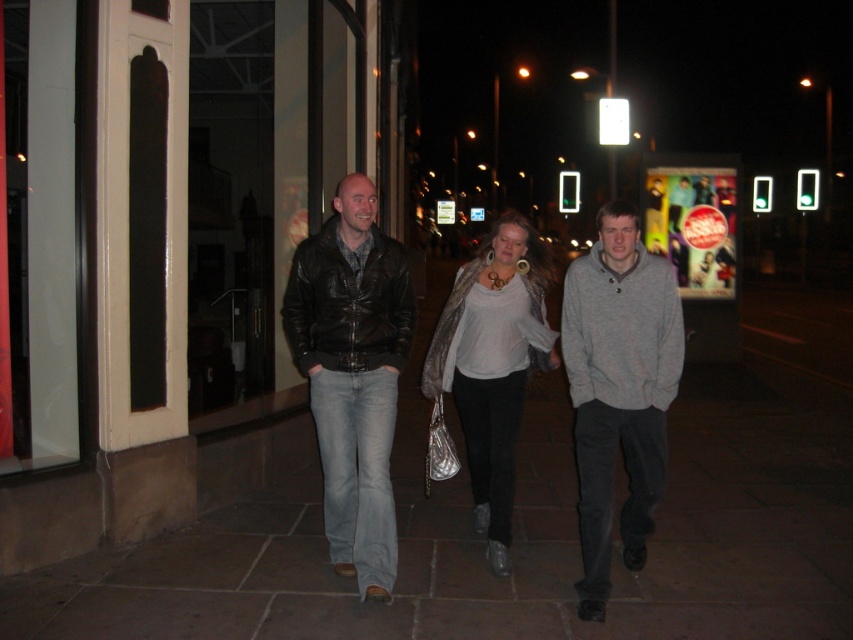
Question: Which of the following is the closest to the observer?

Choices:
 (A) matte black leather jacket at center
 (B) leather jacket at center
 (C) gray cotton hoodie at center
 (D) silver metallic jacket at center

Answer: (C)

Question: Can you confirm if leather jacket at center is positioned to the left of silver metallic jacket at center?

Choices:
 (A) no
 (B) yes

Answer: (B)

Question: Can you confirm if leather jacket at center is positioned below silver metallic jacket at center?

Choices:
 (A) yes
 (B) no

Answer: (B)

Question: Which point is closer to the camera?

Choices:
 (A) gray cotton hoodie at center
 (B) black leather jacket at center

Answer: (A)

Question: Estimate the real-world distances between objects in this image. Which object is closer to the silver metallic jacket at center?

Choices:
 (A) leather jacket at center
 (B) matte black leather jacket at center
 (C) gray cotton hoodie at center
 (D) black leather jacket at center

Answer: (A)

Question: Can you confirm if matte black leather jacket at center is positioned to the right of silver metallic jacket at center?

Choices:
 (A) yes
 (B) no

Answer: (B)